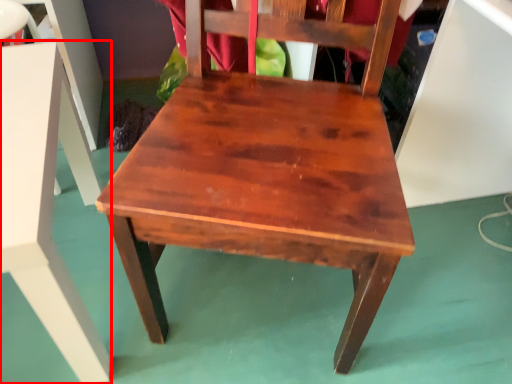
Question: From the image's perspective, considering the relative positions of table (annotated by the red box) and chair in the image provided, where is table (annotated by the red box) located with respect to the staircase?

Choices:
 (A) below
 (B) above

Answer: (A)